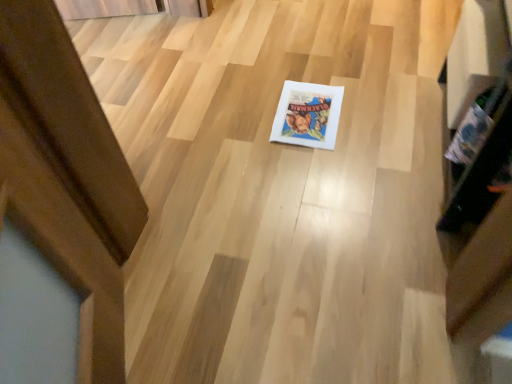
This screenshot has width=512, height=384. Find the location of `white paper book at center`. white paper book at center is located at coordinates point(308,115).

What is the approximate width of white paper book at center?

The width of white paper book at center is 11.92 inches.

Image resolution: width=512 pixels, height=384 pixels. What do you see at coordinates (308, 115) in the screenshot? I see `white paper book at center` at bounding box center [308, 115].

The height and width of the screenshot is (384, 512). Identify the location of white paper book at center. (308, 115).